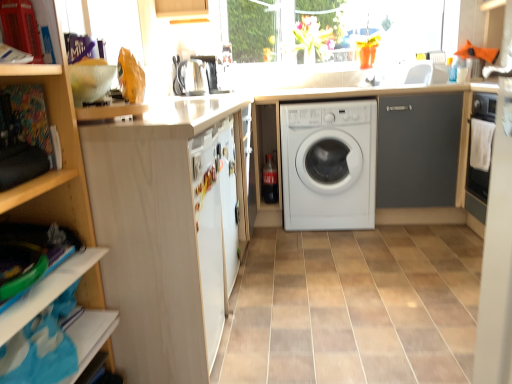
Question: Can you confirm if white glossy sink at upper right is shorter than white matte refrigerator at center?

Choices:
 (A) yes
 (B) no

Answer: (A)

Question: Does white glossy sink at upper right have a greater width compared to white matte refrigerator at center?

Choices:
 (A) no
 (B) yes

Answer: (B)

Question: From the image's perspective, is white glossy sink at upper right over white matte refrigerator at center?

Choices:
 (A) no
 (B) yes

Answer: (B)

Question: Is white glossy sink at upper right to the right of white matte refrigerator at center from the viewer's perspective?

Choices:
 (A) no
 (B) yes

Answer: (B)

Question: Can you confirm if white glossy sink at upper right is taller than white matte refrigerator at center?

Choices:
 (A) no
 (B) yes

Answer: (A)

Question: Visually, is white wood cabinet at left, arranged as the 1th cabinetry when viewed from the front, positioned to the left or to the right of satin silver coffee machine at upper center?

Choices:
 (A) right
 (B) left

Answer: (B)

Question: Choose the correct answer: Is white wood cabinet at left, arranged as the 1th cabinetry when viewed from the front, inside satin silver coffee machine at upper center or outside it?

Choices:
 (A) outside
 (B) inside

Answer: (A)

Question: From a real-world perspective, is white wood cabinet at left, which is the second cabinetry from right to left, above or below satin silver coffee machine at upper center?

Choices:
 (A) below
 (B) above

Answer: (A)

Question: Relative to satin silver coffee machine at upper center, is white wood cabinet at left, which is the first cabinetry in left-to-right order, in front or behind?

Choices:
 (A) behind
 (B) front

Answer: (B)

Question: In terms of size, does white glossy sink at upper right appear bigger or smaller than white wood cabinet at left, arranged as the 1th cabinetry when viewed from the front?

Choices:
 (A) big
 (B) small

Answer: (B)

Question: Would you say white glossy sink at upper right is inside or outside white wood cabinet at left, the 2th cabinetry when ordered from back to front?

Choices:
 (A) inside
 (B) outside

Answer: (B)

Question: From the image's perspective, is white glossy sink at upper right located above or below white wood cabinet at left, which is the second cabinetry from right to left?

Choices:
 (A) below
 (B) above

Answer: (B)

Question: From a real-world perspective, is white glossy sink at upper right physically located above or below white wood cabinet at left, arranged as the 1th cabinetry when viewed from the front?

Choices:
 (A) above
 (B) below

Answer: (A)

Question: Based on their sizes in the image, would you say satin silver coffee machine at upper center is bigger or smaller than white matte refrigerator at center?

Choices:
 (A) small
 (B) big

Answer: (B)

Question: Is satin silver coffee machine at upper center taller or shorter than white matte refrigerator at center?

Choices:
 (A) short
 (B) tall

Answer: (A)